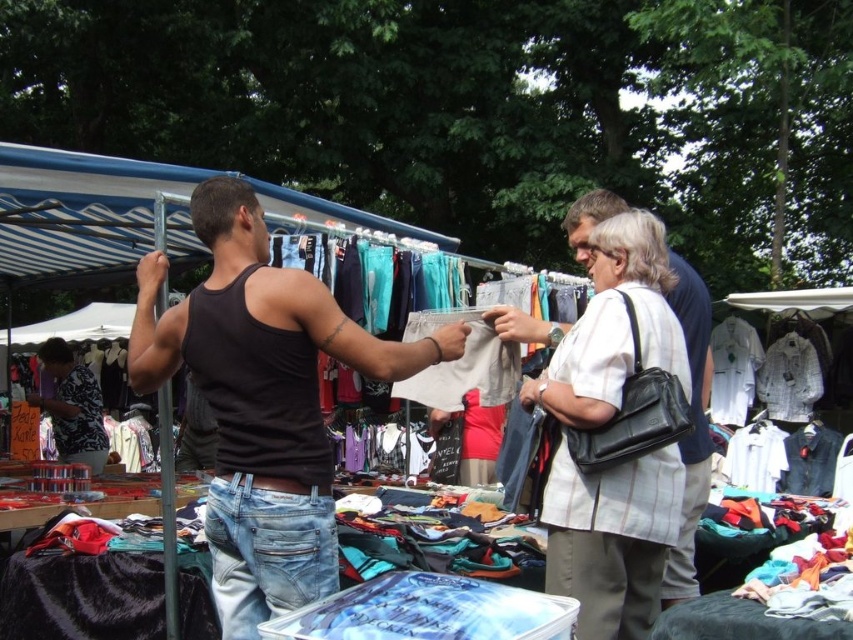
You are a customer at the flea market and want to know which clothing item is taller between the black matte tank top at center and the white striped shirt at center. Can you tell me which one is taller?

The black matte tank top at center is taller than the white striped shirt at center.

You are a customer at the market and want to buy both the black matte tank top at center and the white striped shirt at center. If you first pick up the one on the left, which item will you have in your hand?

The black matte tank top at center is to the left of the white striped shirt at center, so you will have the black matte tank top at center in your hand.

You are a customer at the flea market and see both the white striped shirt at center and the printed cotton shirt at center. Which one is positioned higher?

The white striped shirt at center is located above the printed cotton shirt at center, so it is positioned higher.